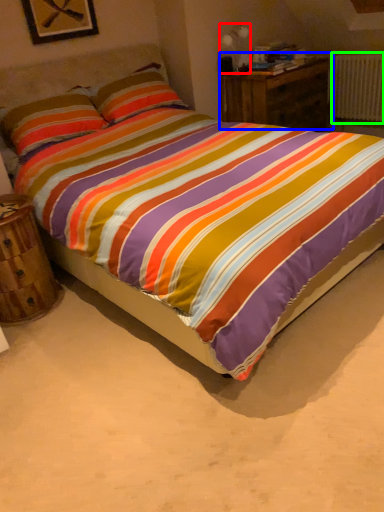
Question: Which object is the closest to the table lamp (highlighted by a red box)? Choose among these: nightstand (highlighted by a blue box) or radiator (highlighted by a green box).

Choices:
 (A) nightstand
 (B) radiator

Answer: (A)